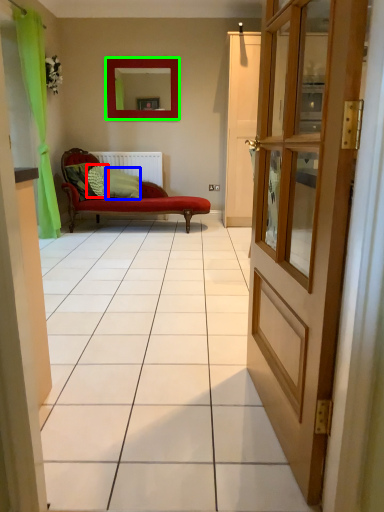
Question: Which is farther away from pillow (highlighted by a red box)? pillow (highlighted by a blue box) or mirror (highlighted by a green box)?

Choices:
 (A) pillow
 (B) mirror

Answer: (B)